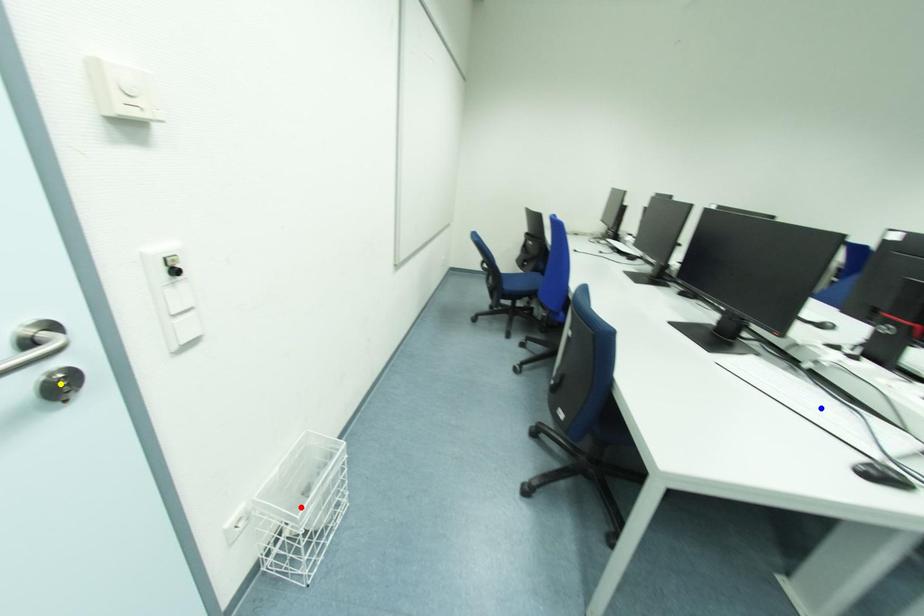
Order these from nearest to farthest:
yellow point, red point, blue point

yellow point → blue point → red point